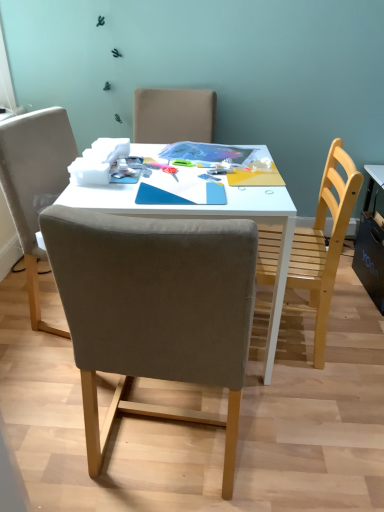
Locate an element on the screen. free space above white glossy table at center (from a real-world perspective) is located at coordinates (169, 169).